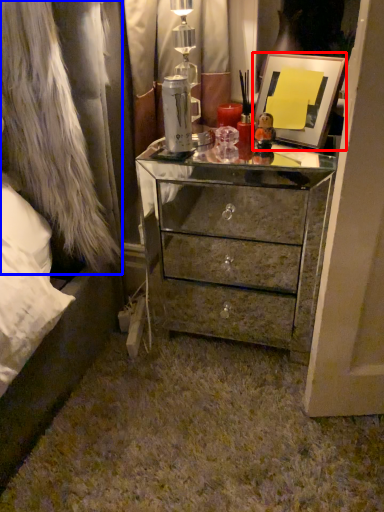
Question: Among these objects, which one is nearest to the camera, picture frame (highlighted by a red box) or fur coat (highlighted by a blue box)?

Choices:
 (A) picture frame
 (B) fur coat

Answer: (B)